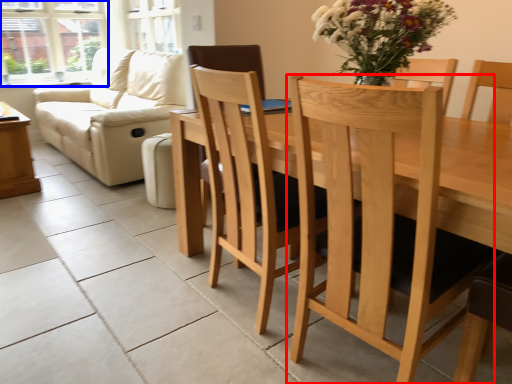
Question: Among these objects, which one is farthest to the camera, chair (highlighted by a red box) or window (highlighted by a blue box)?

Choices:
 (A) chair
 (B) window

Answer: (B)